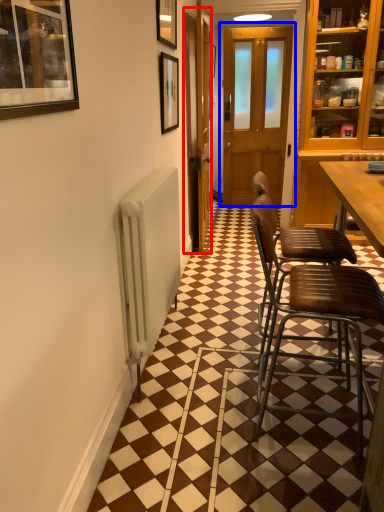
Question: Among these objects, which one is nearest to the camera, screen door (highlighted by a red box) or door (highlighted by a blue box)?

Choices:
 (A) screen door
 (B) door

Answer: (A)